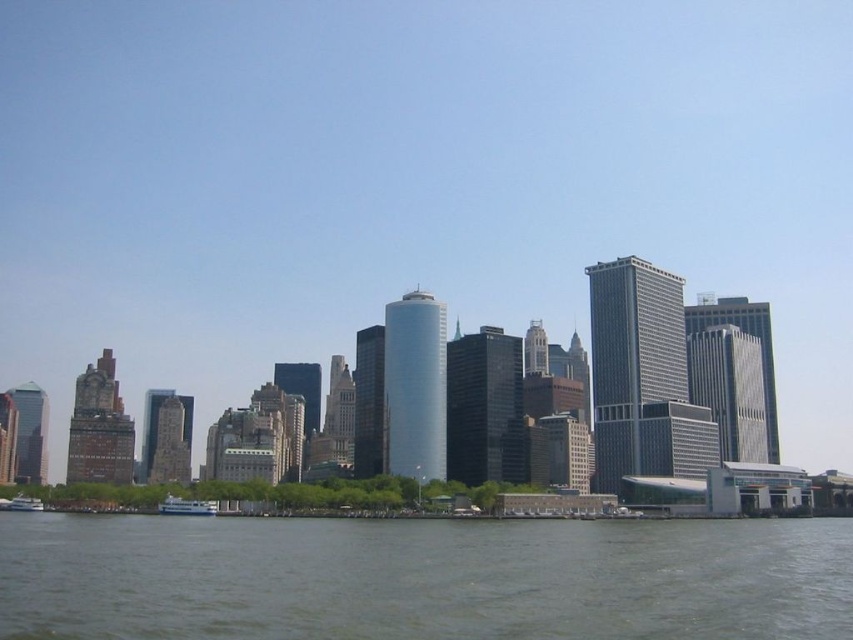
Does gray water at lower center have a smaller size compared to white glossy boat at lower left?

No.

Who is lower down, gray water at lower center or white glossy boat at lower left?

white glossy boat at lower left

Identify the location of gray water at lower center. (422, 579).

Who is more forward, (x=428, y=589) or (x=161, y=513)?

Point (x=428, y=589) is in front.

The width and height of the screenshot is (853, 640). In order to click on gray water at lower center in this screenshot , I will do `click(422, 579)`.

Who is higher up, white glossy ferry at lower center or white glossy boat at lower left?

white glossy ferry at lower center

Who is shorter, white glossy ferry at lower center or white glossy boat at lower left?

Standing shorter between the two is white glossy boat at lower left.

Which is behind, point (216, 508) or point (28, 512)?

The point (28, 512) is behind.

Find the location of a particular element. This screenshot has width=853, height=640. white glossy ferry at lower center is located at coordinates (186, 506).